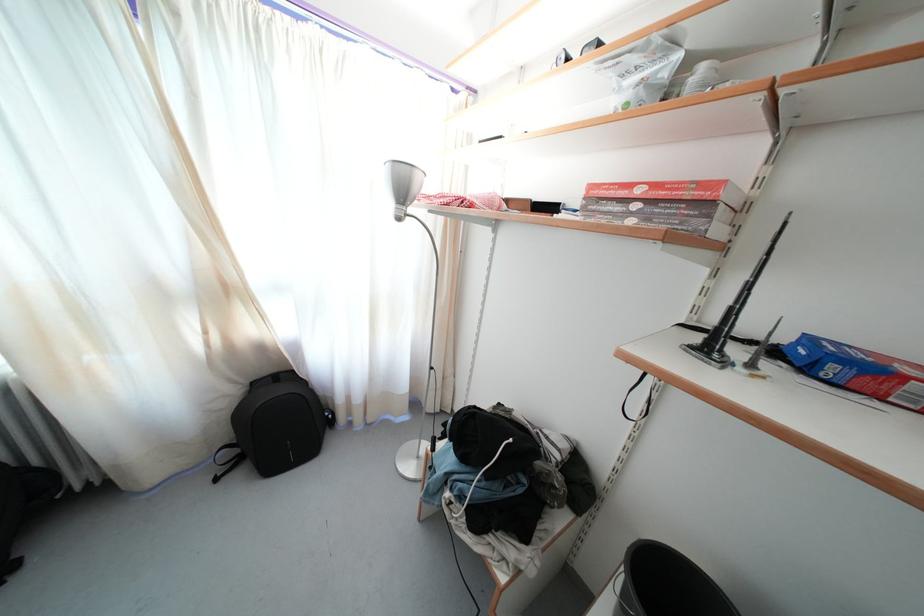
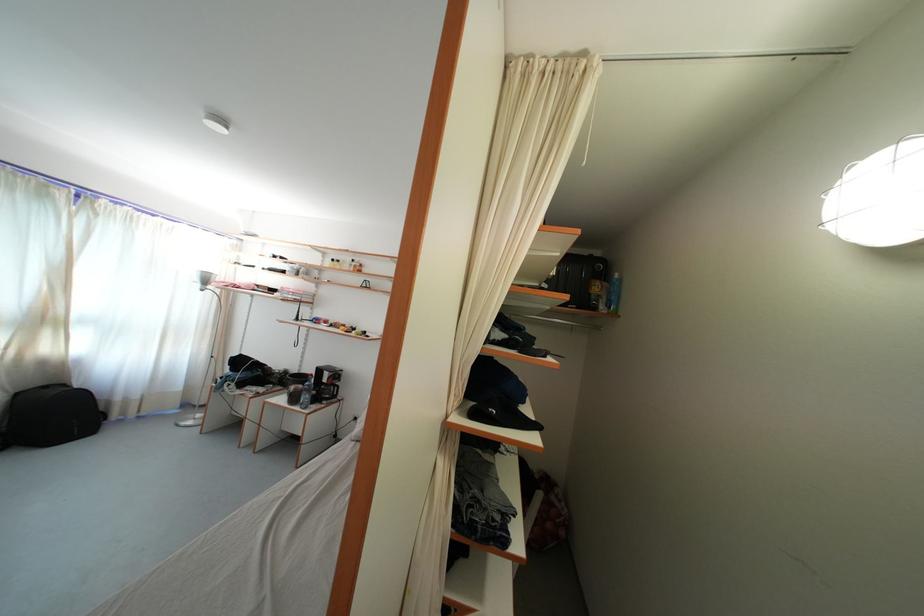
Locate, in the second image, the point that corresponds to point (259, 390) in the first image.

(23, 400)